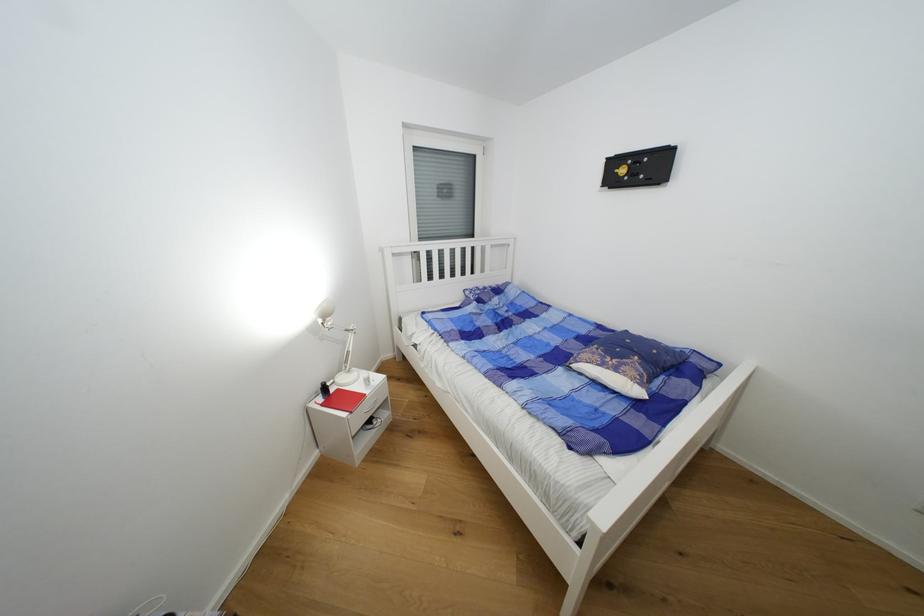
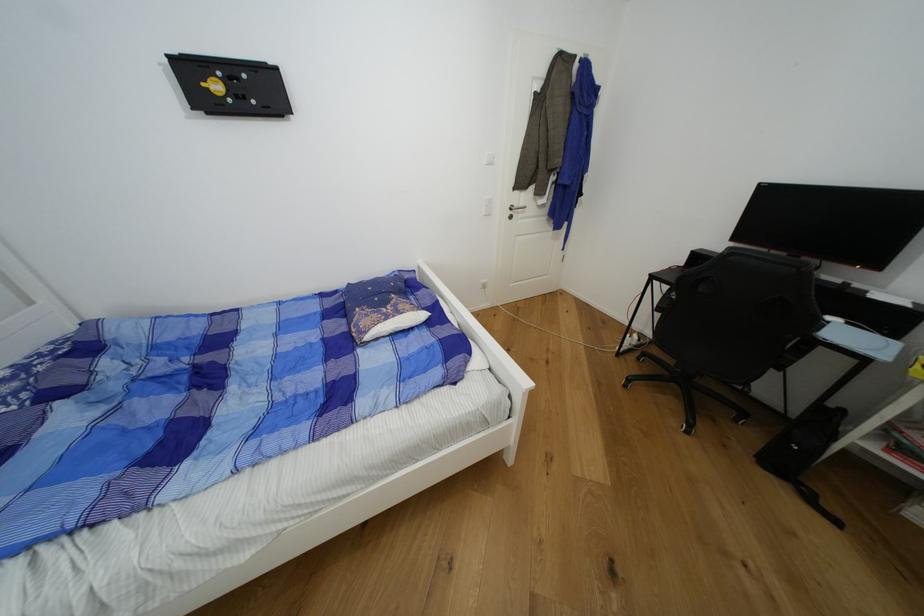
The images are taken continuously from a first-person perspective. In which direction is your viewpoint rotating?

The camera's rotation is toward right-down.